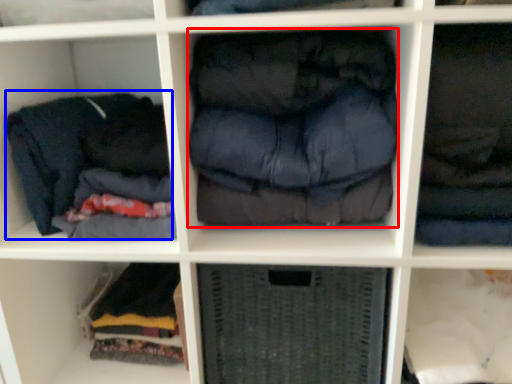
Question: Which point is closer to the camera, clothing (highlighted by a red box) or clothing (highlighted by a blue box)?

Choices:
 (A) clothing
 (B) clothing

Answer: (A)